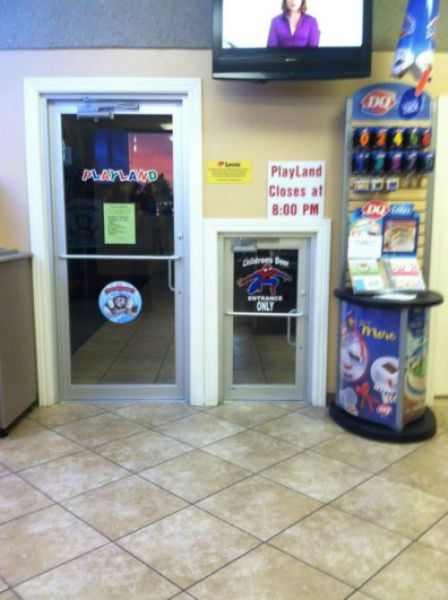
This screenshot has height=600, width=448. In order to click on display in this screenshot , I will do `click(378, 329)`, `click(390, 191)`.